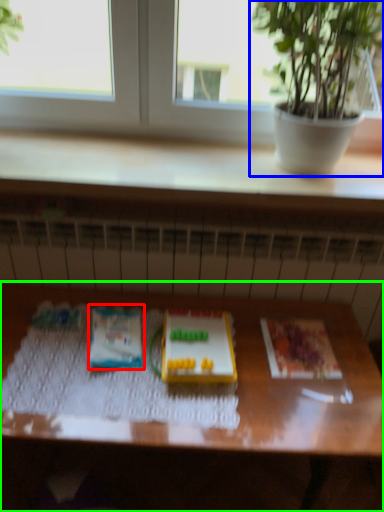
Question: Which object is positioned closest to paperback book (highlighted by a red box)? Select from houseplant (highlighted by a blue box) and table (highlighted by a green box).

Choices:
 (A) houseplant
 (B) table

Answer: (B)